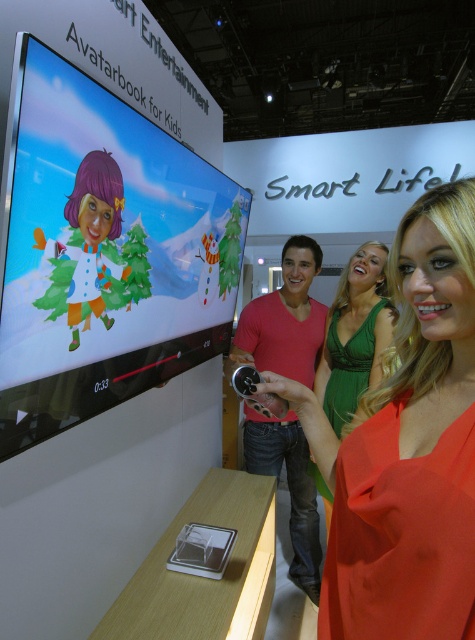
You are organizing a photo shoot and need to place two dresses side by side on a mannequin stand. The stand can only accommodate one dress at a time. Given the orange satin dress at center and the green satin dress at center, which dress would require the stand to be adjusted to a wider setting?

The green satin dress at center requires the stand to be adjusted to a wider setting because it has a greater width than the orange satin dress at center.

You are a photographer at the exhibition and need to capture a photo that includes both the orange satin dress at center and the matte red shirt at center. The camera can only focus on objects within a 3.5 feet range. Will you be able to capture both subjects in focus?

The distance between the orange satin dress at center and the matte red shirt at center is 3.87 feet, which exceeds the camera focus range of 3.5 feet. Therefore, both subjects cannot be in focus simultaneously.

You are at the exhibition and see the matte red shirt at center and the green satin dress at center. Which one is positioned to the left?

The matte red shirt at center is positioned to the left of the green satin dress at center.